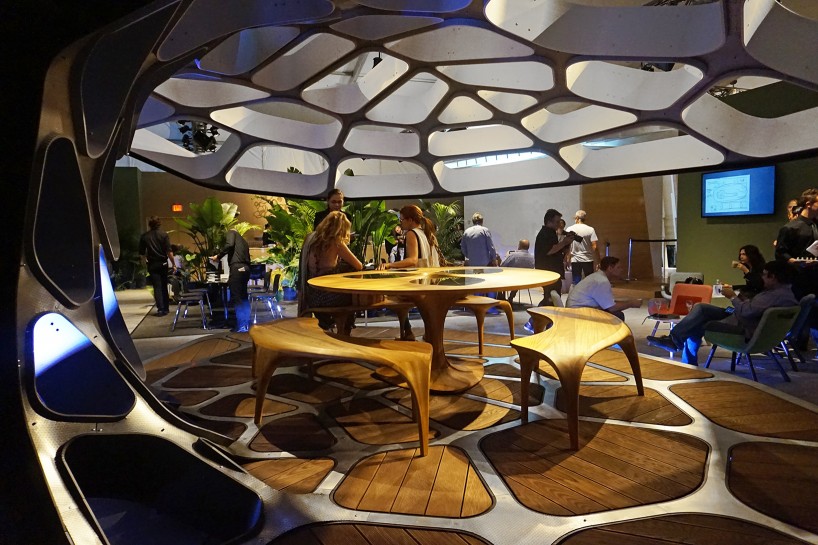
Locate an element on the screen. Image resolution: width=818 pixels, height=545 pixels. glass inserts in large wooden table is located at coordinates (483, 269), (378, 275), (452, 281).